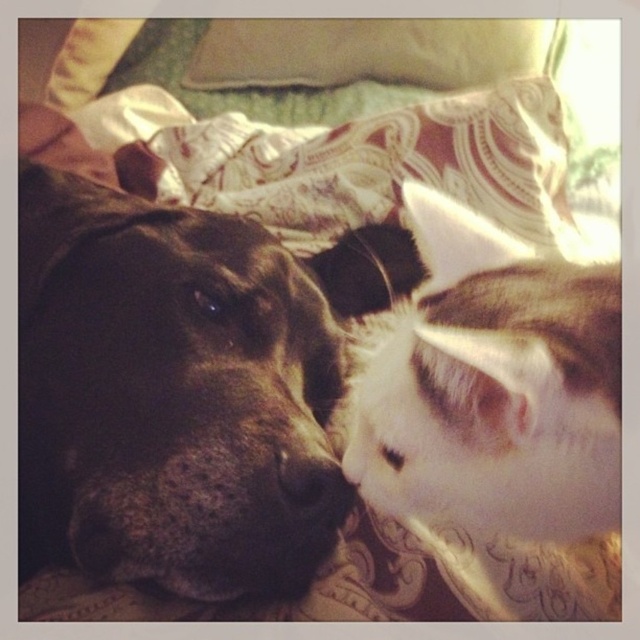
You are standing in front of the bed where the black fur dog at center is resting. If you want to place a small toy exactly where the dog is, what are the coordinates you should aim for?

The coordinates for the black fur dog at center are 0.606 on the x and 0.283 on the y axis. You should aim for those coordinates to place the toy exactly where the dog is.

You are a photographer setting up a shot of the dog and cat resting together. You want to place a velvet beige pillow at upper center to frame the scene. Where should you place it?

Place the velvet beige pillow at upper center at point (365, 51) to frame the scene.

You are a pet sitter observing the scene. You need to determine the relative positions of the two animals. Which animal is closer to you, the black fur dog at center or the white fluffy cat at center?

The black fur dog at center is closer to you because the white fluffy cat at center is positioned behind it.